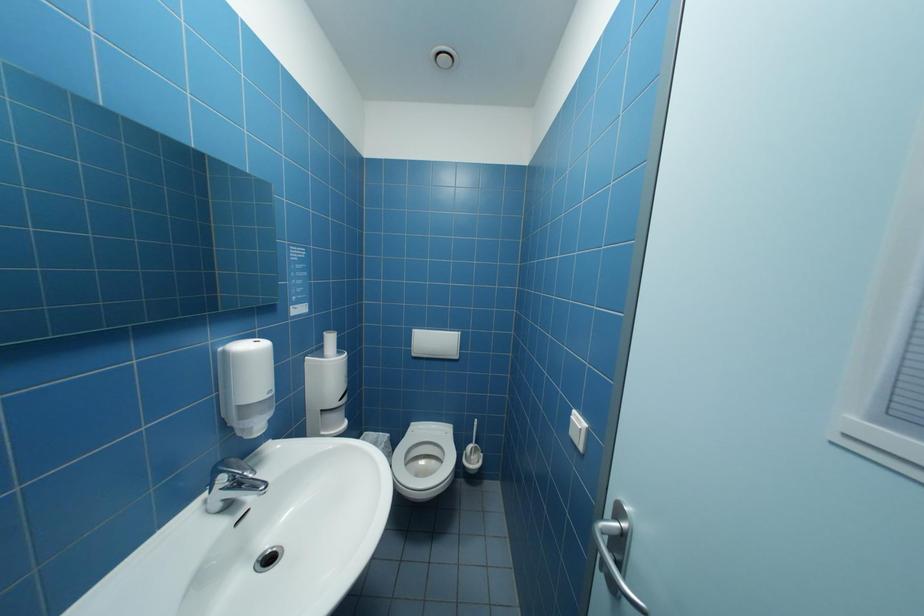
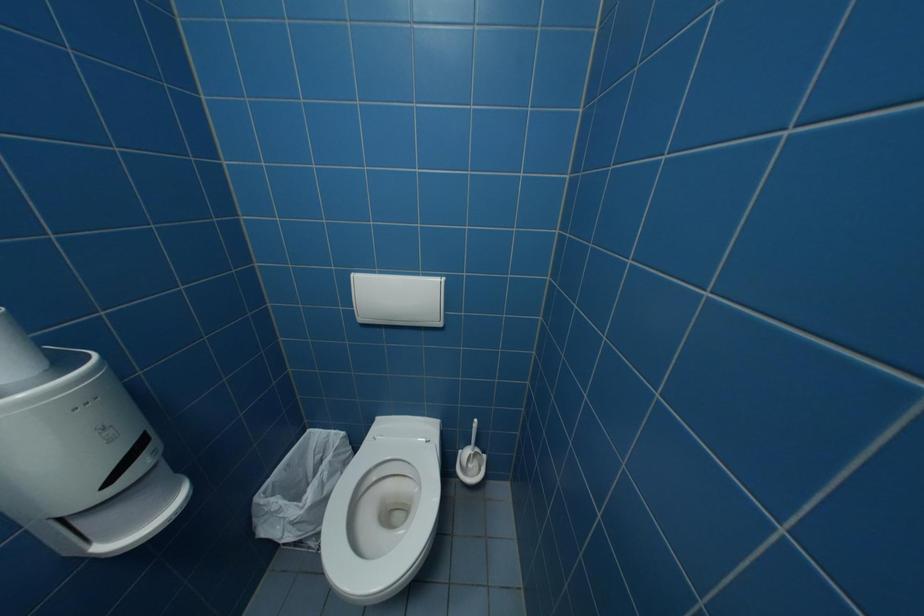
Question: The images are taken continuously from a first-person perspective. In which direction is your viewpoint rotating?

Choices:
 (A) Left
 (B) Right
 (C) Up
 (D) Down

Answer: (D)